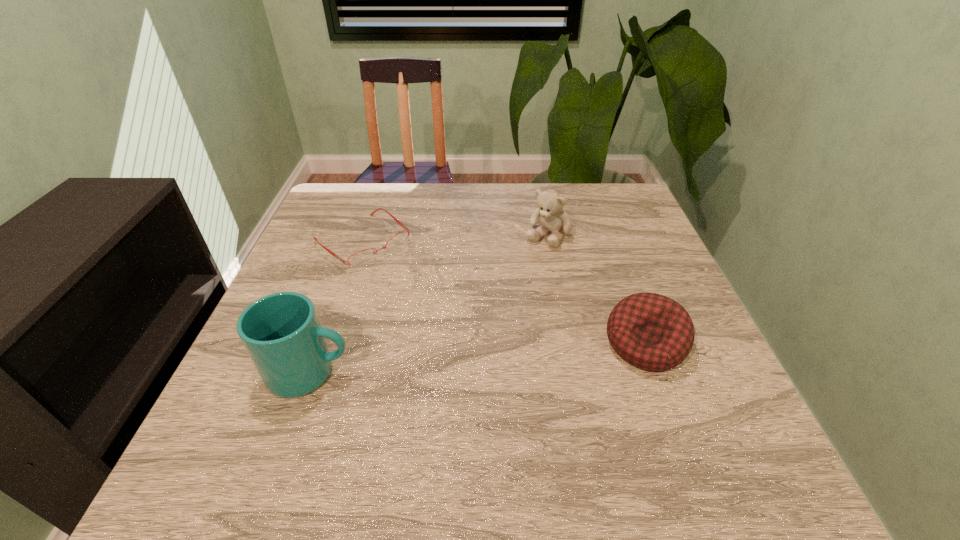
Where is `free space located on the lenses of the spectacles`? free space located on the lenses of the spectacles is located at coordinates (472, 330).

I want to click on free space located on the lenses of the spectacles, so click(x=454, y=315).

At what (x,y) coordinates should I click in order to perform the action: click on free region located on the lenses of the spectacles. Please return your answer as a coordinate pair (x, y). The image size is (960, 540). Looking at the image, I should click on (445, 308).

Where is `teddy bear at the far edge`? The width and height of the screenshot is (960, 540). teddy bear at the far edge is located at coordinates (552, 219).

This screenshot has height=540, width=960. I want to click on spectacles present at the far edge, so click(x=364, y=257).

I want to click on object that is at the near edge, so click(281, 332).

What are the coordinates of `cup at the left edge` in the screenshot? It's located at (281, 332).

Locate an element on the screen. spectacles situated at the left edge is located at coordinates (364, 257).

You are a GUI agent. You are given a task and a screenshot of the screen. Output one action in this format:
    pyautogui.click(x=<x>, y=<y>)
    Task: Click on the object that is at the right edge
    The image size is (960, 540).
    Given the screenshot: What is the action you would take?
    pyautogui.click(x=652, y=332)

I want to click on object at the far left corner, so click(x=364, y=257).